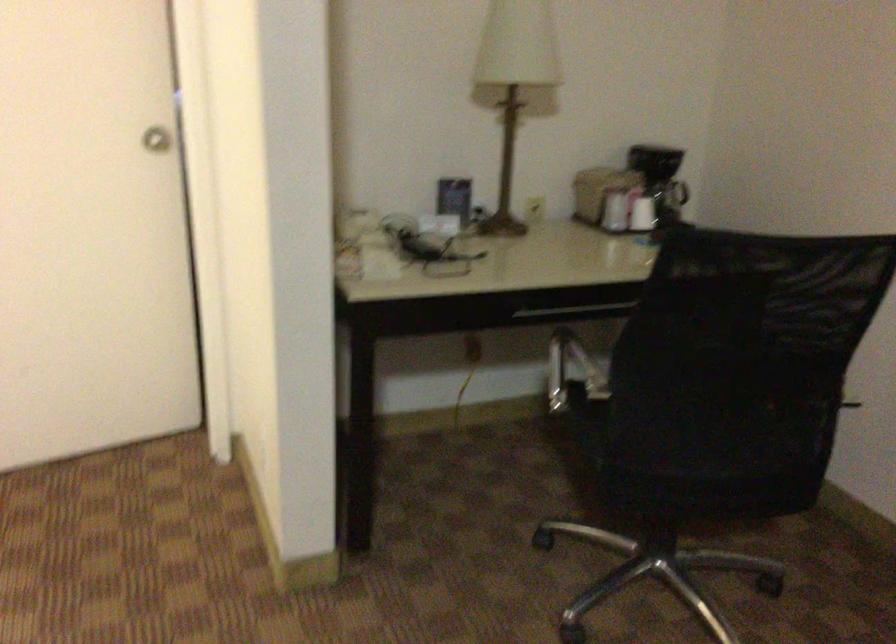
Where would you sit the chair sitting surface? Please return your answer as a coordinate pair (x, y).

(582, 417)